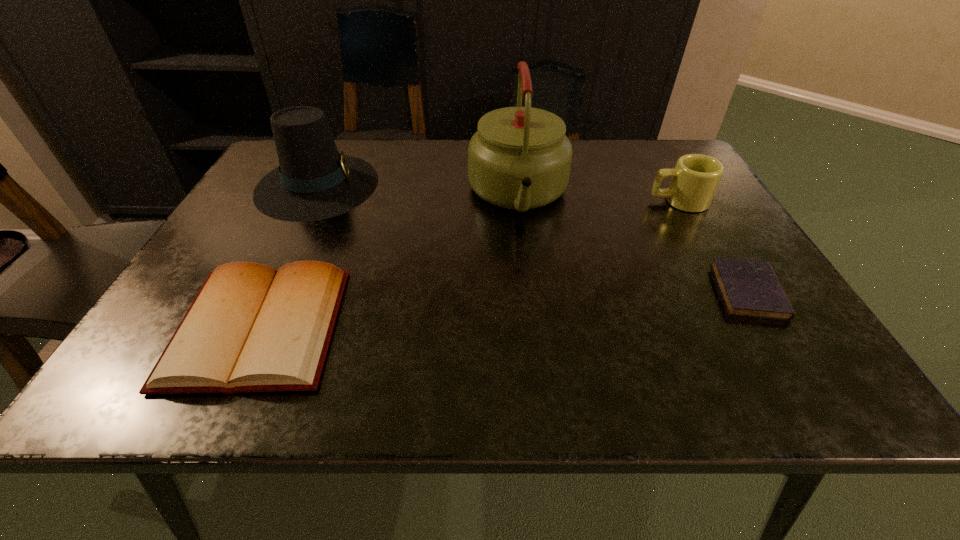
The height and width of the screenshot is (540, 960). Find the location of `the tallest object`. the tallest object is located at coordinates (520, 158).

This screenshot has height=540, width=960. Find the location of `kettle`. kettle is located at coordinates coord(520,158).

I want to click on hat, so point(314,181).

Image resolution: width=960 pixels, height=540 pixels. In order to click on the third tallest object in this screenshot , I will do `click(695, 178)`.

Locate an element on the screen. Image resolution: width=960 pixels, height=540 pixels. the second shortest object is located at coordinates (251, 328).

Locate an element on the screen. The height and width of the screenshot is (540, 960). the shortest object is located at coordinates (749, 288).

Find the location of a particular element. free space located at the spout of the third object from left to right is located at coordinates (540, 389).

Where is `free space located 0.270m on the front-facing side of the second tallest object`? free space located 0.270m on the front-facing side of the second tallest object is located at coordinates (482, 185).

Locate an element on the screen. The height and width of the screenshot is (540, 960). free region located with the handle on the side of the mug is located at coordinates (522, 201).

What are the coordinates of `vacant region located with the handle on the side of the mug` in the screenshot? It's located at (522, 201).